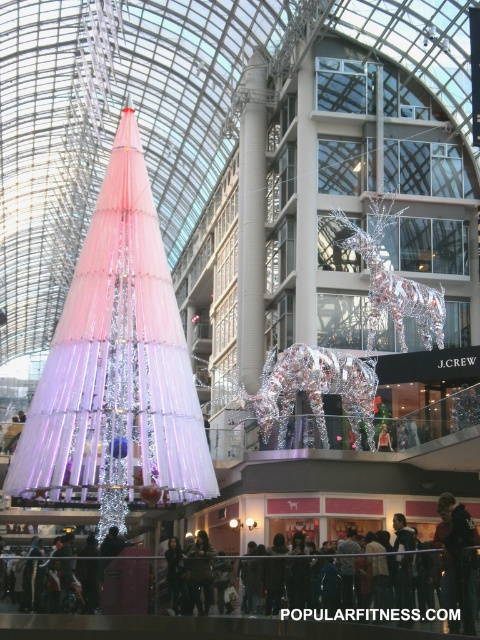
Question: Can you confirm if shiny metallic reindeer at center is smaller than silver metallic reindeer at center?

Choices:
 (A) yes
 (B) no

Answer: (B)

Question: Which point is farther to the camera?

Choices:
 (A) (381, 211)
 (B) (304, 378)

Answer: (A)

Question: Can you confirm if shiny metallic reindeer at center is smaller than silver metallic reindeer at center?

Choices:
 (A) yes
 (B) no

Answer: (B)

Question: Which object appears closest to the camera in this image?

Choices:
 (A) shiny metallic reindeer at center
 (B) silver metallic reindeer at center

Answer: (A)

Question: Which object is farther from the camera taking this photo?

Choices:
 (A) silver metallic reindeer at center
 (B) shiny metallic reindeer at center

Answer: (A)

Question: In this image, where is shiny metallic reindeer at center located relative to silver metallic reindeer at center?

Choices:
 (A) right
 (B) left

Answer: (B)